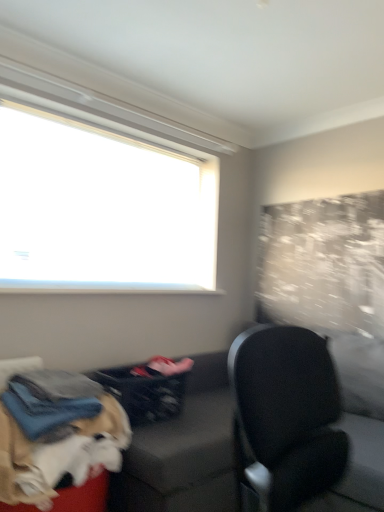
Question: Considering the positions of black leather chair at right and dark gray fabric laundry basket at lower center in the image, is black leather chair at right bigger or smaller than dark gray fabric laundry basket at lower center?

Choices:
 (A) small
 (B) big

Answer: (B)

Question: Is black leather chair at right in front of or behind dark gray fabric laundry basket at lower center in the image?

Choices:
 (A) behind
 (B) front

Answer: (B)

Question: Estimate the real-world distances between objects in this image. Which object is farther from the black leather chair at right?

Choices:
 (A) dark gray fabric couch at lower left
 (B) dark gray fabric laundry basket at lower center
 (C) white fluffy dog at lower left

Answer: (B)

Question: Estimate the real-world distances between objects in this image. Which object is closer to the dark gray fabric laundry basket at lower center?

Choices:
 (A) white fluffy dog at lower left
 (B) dark gray fabric couch at lower left
 (C) black leather chair at right

Answer: (A)